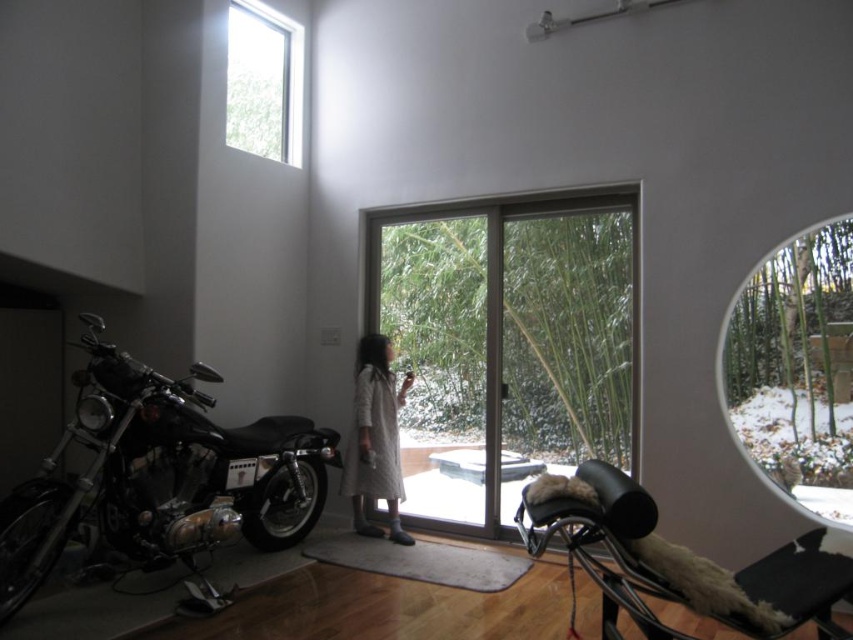
You are a delivery person trying to deliver a package to the house. You see the clear glass screen door at center and the white textured coat at center. Which one is wider?

The clear glass screen door at center is wider than the white textured coat at center.

You are a delivery person trying to bring a 3.5 meter long package into the room. The package must be carried horizontally. Based on the scene, is there enough space between the shiny black motorcycle at left and the transparent glass window at upper right to fit the package?

The distance between the shiny black motorcycle at left and the transparent glass window at upper right is 3.01 meters. Since the package is 3.5 meters long, it is longer than the available space. Therefore, the package cannot fit between them.

You are standing in the room and want to move towards the sliding glass doors to see the snowy bamboo plants outside. Is the shiny black motorcycle at left blocking your path?

The shiny black motorcycle at left is located at point (160, 476), which is near the wall close to the sliding doors. Since it is positioned at the left side, it might be blocking part of the path towards the doors. However, without knowing the exact dimensions of the room and the motorcycle, it is difficult to determine if there is enough space to navigate around it. Please check the available space to the right of the motorcycle to proceed safely.